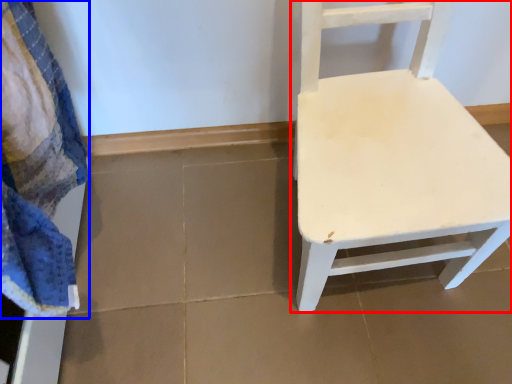
Question: Which object is further to the camera taking this photo, chair (highlighted by a red box) or bath towel (highlighted by a blue box)?

Choices:
 (A) chair
 (B) bath towel

Answer: (A)